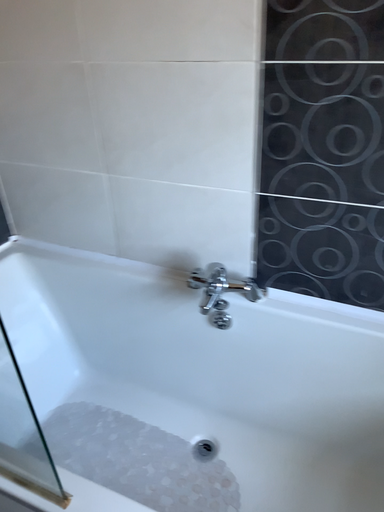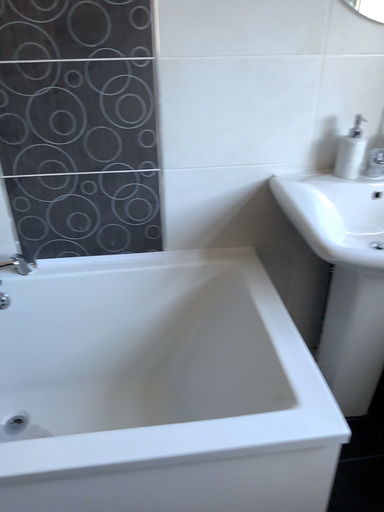
Question: Which way did the camera rotate in the video?

Choices:
 (A) rotated right
 (B) rotated left

Answer: (A)